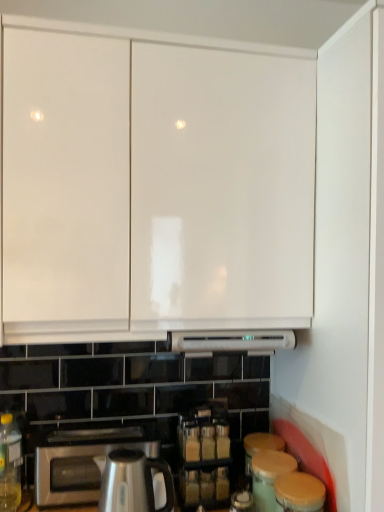
Question: Is the surface of white glossy cabinet at upper center in direct contact with satin silver kettle at lower center?

Choices:
 (A) no
 (B) yes

Answer: (A)

Question: Is white glossy cabinet at upper center aimed at satin silver kettle at lower center?

Choices:
 (A) no
 (B) yes

Answer: (A)

Question: Can satin silver kettle at lower center be found inside white glossy cabinet at upper center?

Choices:
 (A) no
 (B) yes

Answer: (A)

Question: Is white glossy cabinet at upper center to the right of satin silver kettle at lower center from the viewer's perspective?

Choices:
 (A) yes
 (B) no

Answer: (A)

Question: Would you say white glossy cabinet at upper center is a long distance from satin silver kettle at lower center?

Choices:
 (A) yes
 (B) no

Answer: (B)

Question: Does point pos(140,474) appear closer or farther from the camera than point pos(57,480)?

Choices:
 (A) farther
 (B) closer

Answer: (B)

Question: In the image, is satin silver kettle at lower center on the left side or the right side of satin silver toaster at lower left?

Choices:
 (A) right
 (B) left

Answer: (A)

Question: Considering the positions of satin silver kettle at lower center and satin silver toaster at lower left in the image, is satin silver kettle at lower center bigger or smaller than satin silver toaster at lower left?

Choices:
 (A) small
 (B) big

Answer: (A)

Question: Looking at their shapes, would you say satin silver kettle at lower center is wider or thinner than satin silver toaster at lower left?

Choices:
 (A) thin
 (B) wide

Answer: (A)

Question: Choose the correct answer: Is satin silver toaster at lower left inside satin silver kettle at lower center or outside it?

Choices:
 (A) inside
 (B) outside

Answer: (B)

Question: Would you say satin silver toaster at lower left is to the left or to the right of satin silver kettle at lower center in the picture?

Choices:
 (A) right
 (B) left

Answer: (B)

Question: From their relative heights in the image, would you say satin silver toaster at lower left is taller or shorter than satin silver kettle at lower center?

Choices:
 (A) short
 (B) tall

Answer: (A)

Question: From a real-world perspective, is satin silver toaster at lower left physically located above or below satin silver kettle at lower center?

Choices:
 (A) below
 (B) above

Answer: (A)

Question: Considering the positions of translucent yellow bottle at lower left and white glossy cabinet at upper center in the image, is translucent yellow bottle at lower left taller or shorter than white glossy cabinet at upper center?

Choices:
 (A) tall
 (B) short

Answer: (B)

Question: Is point (16, 455) positioned closer to the camera than point (173, 295)?

Choices:
 (A) farther
 (B) closer

Answer: (A)